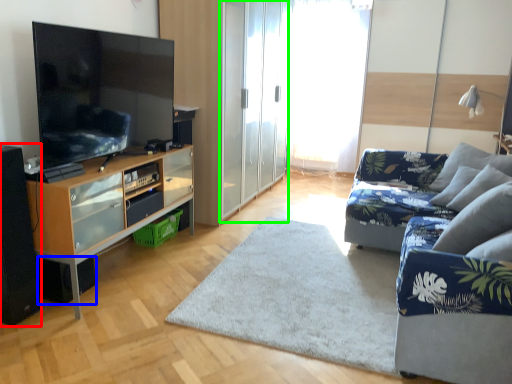
Question: Which object is the farthest from speaker (highlighted by a red box)? Choose among these: speaker (highlighted by a blue box) or screen door (highlighted by a green box).

Choices:
 (A) speaker
 (B) screen door

Answer: (B)